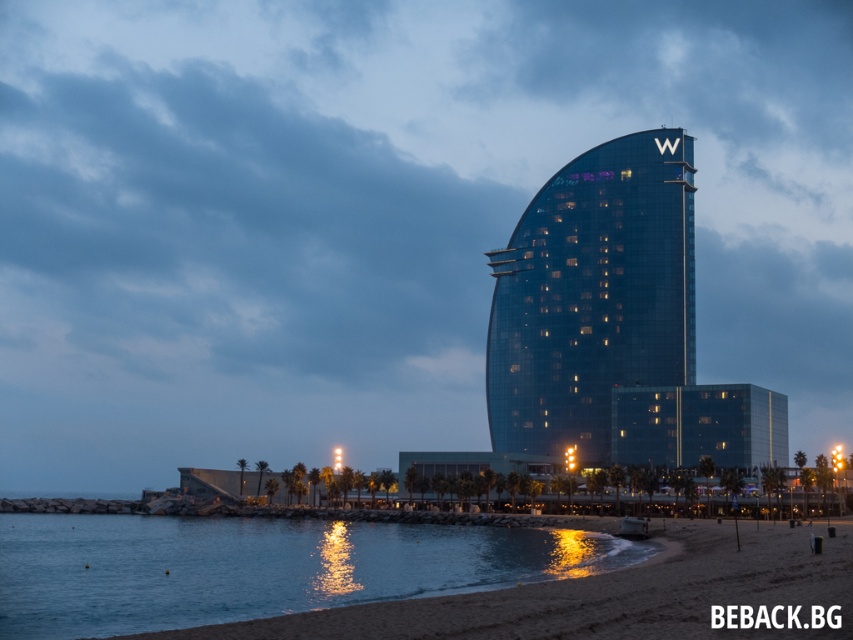
Can you confirm if transparent glass tower at center is taller than glassy blue building at center?

Indeed, transparent glass tower at center has a greater height compared to glassy blue building at center.

Measure the distance from transparent glass tower at center to glassy blue building at center.

transparent glass tower at center and glassy blue building at center are 73.64 feet apart.

Find the location of a particular element. The height and width of the screenshot is (640, 853). transparent glass tower at center is located at coordinates (592, 296).

Consider the image. Between blue glassy water at lower left and transparent glass tower at center, which one appears on the left side from the viewer's perspective?

blue glassy water at lower left is more to the left.

Is blue glassy water at lower left smaller than transparent glass tower at center?

Yes, blue glassy water at lower left is smaller than transparent glass tower at center.

Between point (216, 618) and point (634, 381), which one is positioned behind?

The point (634, 381) is more distant.

Locate an element on the screen. Image resolution: width=853 pixels, height=640 pixels. blue glassy water at lower left is located at coordinates (260, 566).

Does blue glassy water at lower left have a lesser height compared to glassy blue building at center?

In fact, blue glassy water at lower left may be taller than glassy blue building at center.

In the scene shown: Who is more distant from viewer, (1,566) or (657,401)?

The point (657,401) is behind.

Find the location of a particular element. The height and width of the screenshot is (640, 853). blue glassy water at lower left is located at coordinates 260,566.